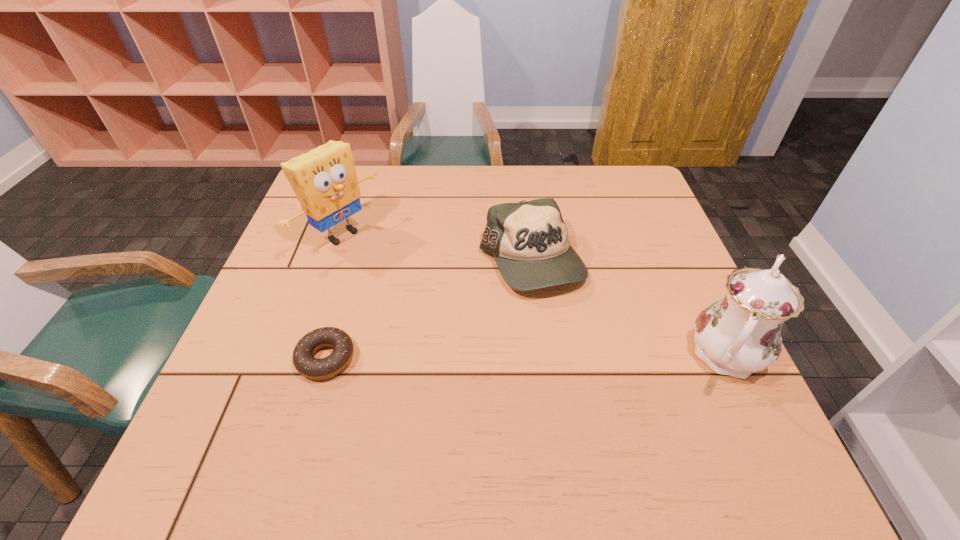
Where is `free space on the desktop that is between the shortest object and the rightmost object and is positioned on the face of the sponge`? This screenshot has height=540, width=960. free space on the desktop that is between the shortest object and the rightmost object and is positioned on the face of the sponge is located at coordinates (529, 356).

The image size is (960, 540). I want to click on vacant spot on the desktop that is between the doughnut and the rightmost object and is positioned on the front-facing side of the third tallest object, so click(x=560, y=356).